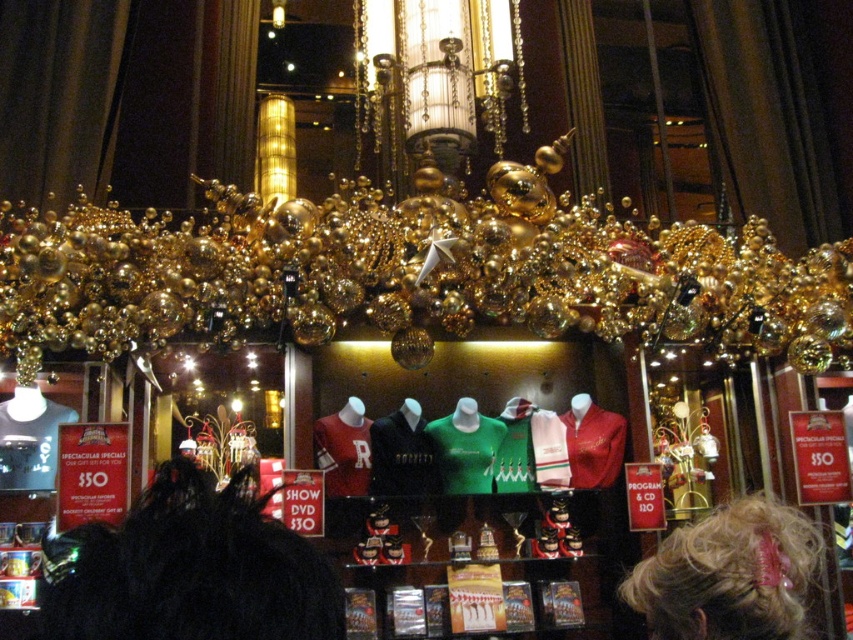
You are a customer browsing the festive display and want to see both the black fur coat at center and the green jersey at center. Which one is positioned higher up in the display?

The black fur coat at center is located above the green jersey at center, so it is positioned higher up in the display.

You are a customer in the store looking at the display. You see the blonde hair at upper right and the green jersey at center. Which one is positioned to the right side of the other?

The blonde hair at upper right is positioned to the right of the green jersey at center.